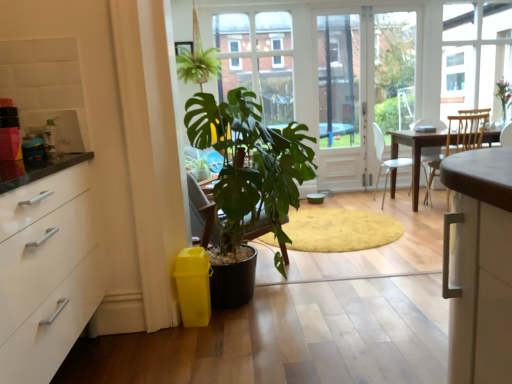
What do you see at coordinates (341, 103) in the screenshot?
I see `transparent glass screen door at center` at bounding box center [341, 103].

What is the approximate width of metallic silver kettle at upper left?

metallic silver kettle at upper left is 3.93 inches wide.

What do you see at coordinates (258, 60) in the screenshot? The height and width of the screenshot is (384, 512). I see `green leafy plant at center` at bounding box center [258, 60].

This screenshot has width=512, height=384. I want to click on transparent glass screen door at center, so click(341, 103).

In the scene shown: Would you say green leafy plant at center is inside or outside transparent glass screen door at center?

green leafy plant at center is not enclosed by transparent glass screen door at center.

Considering the sizes of green leafy plant at center and transparent glass screen door at center in the image, is green leafy plant at center wider or thinner than transparent glass screen door at center?

Clearly, green leafy plant at center has more width compared to transparent glass screen door at center.

Who is taller, green leafy plant at center or transparent glass screen door at center?

With more height is transparent glass screen door at center.

Between green leafy plant at center and transparent glass screen door at center, which one appears on the left side from the viewer's perspective?

green leafy plant at center is more to the left.

From the image's perspective, which is below, white plastic chair at center or green matte plant at center?

From the image's view, green matte plant at center is below.

Who is smaller, white plastic chair at center or green matte plant at center?

With smaller size is white plastic chair at center.

Can you tell me how much white plastic chair at center and green matte plant at center differ in facing direction?

There is a 1.57-degree angle between the facing directions of white plastic chair at center and green matte plant at center.

Between white plastic chair at center and green matte plant at center, which one is positioned behind?

white plastic chair at center is further away from the camera.

Considering the sizes of metallic silver kettle at upper left and transparent glass screen door at center in the image, is metallic silver kettle at upper left wider or thinner than transparent glass screen door at center?

In the image, metallic silver kettle at upper left appears to be more narrow than transparent glass screen door at center.

From the image's perspective, does metallic silver kettle at upper left appear lower than transparent glass screen door at center?

Yes, from the image's perspective, metallic silver kettle at upper left is beneath transparent glass screen door at center.

Measure the distance between metallic silver kettle at upper left and transparent glass screen door at center.

metallic silver kettle at upper left is 4.02 meters from transparent glass screen door at center.

Is metallic silver kettle at upper left turned away from transparent glass screen door at center?

No, metallic silver kettle at upper left is not facing the opposite direction of transparent glass screen door at center.

Can you tell me how much metallic silver kettle at upper left and white plastic chair at center differ in facing direction?

metallic silver kettle at upper left and white plastic chair at center are facing 1.67 degrees away from each other.

Does metallic silver kettle at upper left have a larger size compared to white plastic chair at center?

Incorrect, metallic silver kettle at upper left is not larger than white plastic chair at center.

Considering the sizes of metallic silver kettle at upper left and white plastic chair at center in the image, is metallic silver kettle at upper left taller or shorter than white plastic chair at center?

Considering their sizes, metallic silver kettle at upper left has less height than white plastic chair at center.

Is the surface of metallic silver kettle at upper left in direct contact with white plastic chair at center?

No, metallic silver kettle at upper left is not making contact with white plastic chair at center.

Is point (266, 25) more distant than point (47, 137)?

That is True.

Considering the sizes of objects green leafy plant at center and metallic silver kettle at upper left in the image provided, who is bigger, green leafy plant at center or metallic silver kettle at upper left?

green leafy plant at center.

Is metallic silver kettle at upper left at the back of green leafy plant at center?

No, green leafy plant at center is not facing the opposite direction of metallic silver kettle at upper left.

Which object is more forward, white plastic chair at center or transparent glass screen door at center?

white plastic chair at center is in front.

From the image's perspective, is white plastic chair at center positioned above or below transparent glass screen door at center?

Clearly, from the image's perspective, white plastic chair at center is below transparent glass screen door at center.

Considering the relative sizes of white plastic chair at center and transparent glass screen door at center in the image provided, is white plastic chair at center wider than transparent glass screen door at center?

Yes, white plastic chair at center is wider than transparent glass screen door at center.

Is green matte plant at center facing away from green leafy plant at center?

No, green matte plant at center's orientation is not away from green leafy plant at center.

From the picture: Looking at their sizes, would you say green matte plant at center is wider or thinner than green leafy plant at center?

green matte plant at center is wider than green leafy plant at center.

Could green leafy plant at center be considered to be inside green matte plant at center?

No, green leafy plant at center is located outside of green matte plant at center.

Which point is more forward, (x=229, y=112) or (x=252, y=75)?

The point (x=229, y=112) is closer to the camera.

In the image, there is a transparent glass screen door at center. At what (x,y) coordinates should I click in order to perform the action: click on bay window above it (from the image's perspective). Please return your answer as a coordinate pair (x, y). Looking at the image, I should click on (258, 60).

This screenshot has width=512, height=384. What are the coordinates of `chair beneath the green matte plant at center (from a real-world perspective)` in the screenshot? It's located at (386, 160).

Estimate the real-world distances between objects in this image. Which object is further from white plastic chair at center, transparent glass screen door at center or metallic silver kettle at upper left?

metallic silver kettle at upper left.

When comparing their distances from transparent glass screen door at center, does green leafy plant at center or metallic silver kettle at upper left seem further?

metallic silver kettle at upper left is further to transparent glass screen door at center.

When comparing their distances from metallic silver kettle at upper left, does white plastic chair at center or green matte plant at center seem further?

white plastic chair at center is further to metallic silver kettle at upper left.

Consider the image. From the image, which object appears to be nearer to green leafy plant at center, green matte plant at center or transparent glass screen door at center?

transparent glass screen door at center lies closer to green leafy plant at center than the other object.

Consider the image. Considering their positions, is green matte plant at center positioned closer to green leafy plant at center than white plastic chair at center?

white plastic chair at center.

Looking at the image, which one is located closer to white plastic chair at center, metallic silver kettle at upper left or transparent glass screen door at center?

transparent glass screen door at center lies closer to white plastic chair at center than the other object.

Based on their spatial positions, is transparent glass screen door at center or green matte plant at center further from metallic silver kettle at upper left?

Among the two, transparent glass screen door at center is located further to metallic silver kettle at upper left.

When comparing their distances from green leafy plant at center, does white plastic chair at center or metallic silver kettle at upper left seem further?

metallic silver kettle at upper left is further to green leafy plant at center.

Locate an element on the screen. screen door between green leafy plant at center and white plastic chair at center from left to right is located at coordinates (341, 103).

You are a GUI agent. You are given a task and a screenshot of the screen. Output one action in this format:
    pyautogui.click(x=<x>, y=<y>)
    Task: Click on the appliance between green matte plant at center and transparent glass screen door at center in the front-back direction
    The image size is (512, 384).
    Given the screenshot: What is the action you would take?
    pyautogui.click(x=52, y=138)

You are a GUI agent. You are given a task and a screenshot of the screen. Output one action in this format:
    pyautogui.click(x=<x>, y=<y>)
    Task: Click on the chair located between green matte plant at center and green leafy plant at center in the depth direction
    The height and width of the screenshot is (384, 512).
    Given the screenshot: What is the action you would take?
    pyautogui.click(x=386, y=160)

The height and width of the screenshot is (384, 512). Find the location of `bay window between metallic silver kettle at upper left and transparent glass screen door at center from front to back`. bay window between metallic silver kettle at upper left and transparent glass screen door at center from front to back is located at coordinates (258, 60).